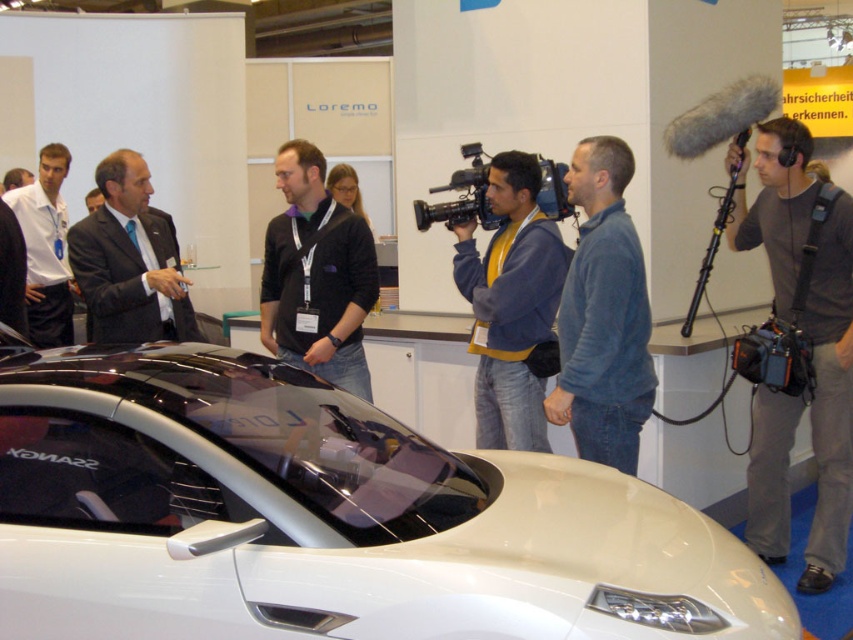
Question: Which point appears farthest from the camera in this image?

Choices:
 (A) (796, 346)
 (B) (512, 339)
 (C) (474, 195)
 (D) (590, 193)

Answer: (C)

Question: Does white glossy car at center appear over black matte video camera at right?

Choices:
 (A) yes
 (B) no

Answer: (B)

Question: Which object is positioned closest to the dark blue suit at center?

Choices:
 (A) blue fleece jacket at center
 (B) blue hoodie at center

Answer: (B)

Question: Is white glossy car at center positioned before black matte video camera at right?

Choices:
 (A) no
 (B) yes

Answer: (B)

Question: Does blue fleece jacket at center lie behind dark blue suit at center?

Choices:
 (A) no
 (B) yes

Answer: (A)

Question: Which point is farther to the camera?

Choices:
 (A) white shirt at left
 (B) gray fabric camera at right
 (C) black matte video camera at right

Answer: (A)